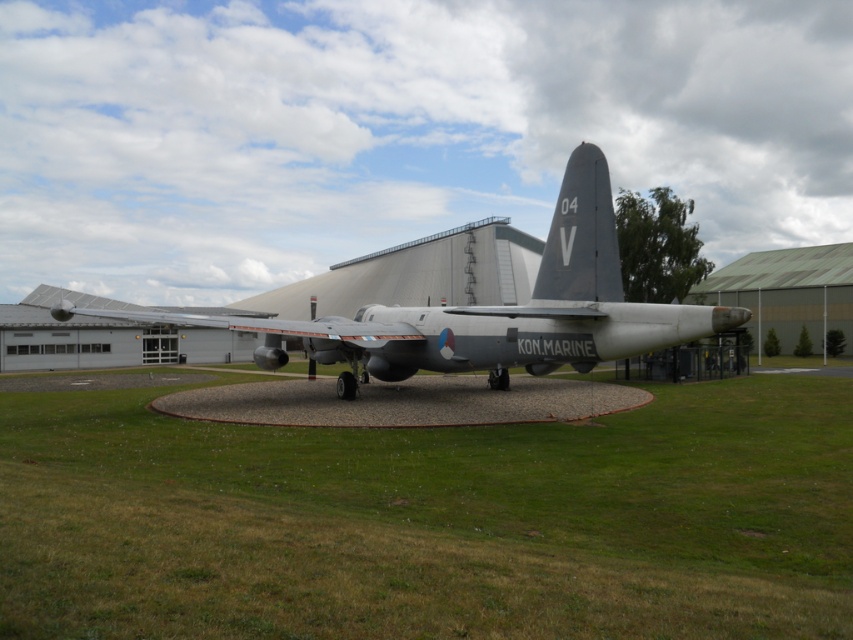
Question: Does green grass at center have a smaller size compared to silver metallic airplane at center?

Choices:
 (A) no
 (B) yes

Answer: (B)

Question: Does green grass at center have a larger size compared to silver metallic airplane at center?

Choices:
 (A) yes
 (B) no

Answer: (B)

Question: Which point is farther to the camera?

Choices:
 (A) pyautogui.click(x=577, y=304)
 (B) pyautogui.click(x=747, y=499)

Answer: (A)

Question: Which point appears closest to the camera in this image?

Choices:
 (A) (666, 340)
 (B) (624, 477)

Answer: (B)

Question: Is green grass at center wider than silver metallic airplane at center?

Choices:
 (A) yes
 (B) no

Answer: (A)